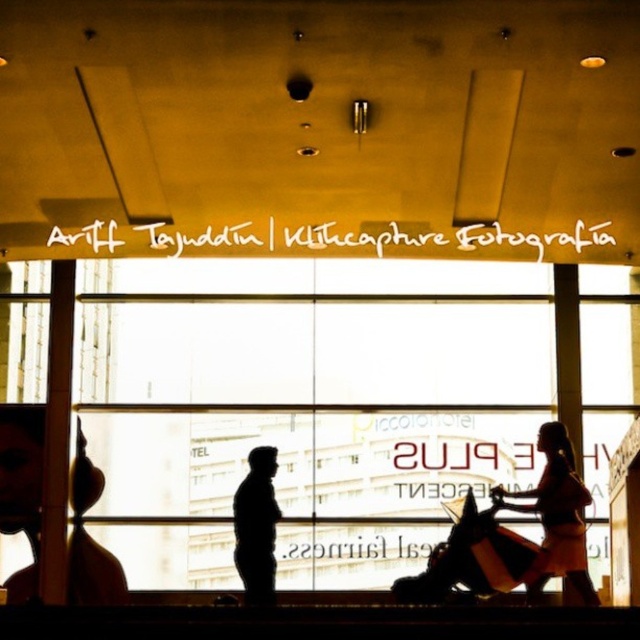
You are a photographer setting up a shoot in this space. You need to position a small prop that must be placed between the matte black baby carriage at lower center and the black matte figure at center. Considering their sizes, which object should the prop be closer to?

The prop should be placed closer to the matte black baby carriage at lower center because it has a smaller size compared to the black matte figure at center, so the prop can be positioned near it without overwhelming the smaller object.

You are a photographer setting up equipment in the modern building. You notice the matte black baby carriage at lower center and the silhouette dress at center. Which object should you adjust your camera focus to first if you want to capture both in the same frame, considering their sizes?

The matte black baby carriage at lower center is smaller than the silhouette dress at center, so you should focus on the silhouette dress at center first to ensure its details are sharp before adjusting for the smaller carriage.

You are a fashion designer observing a display in a modern building. You notice a silhouette dress at center and a black matte figure at center. Which object is taller?

The silhouette dress at center is taller than the black matte figure at center.